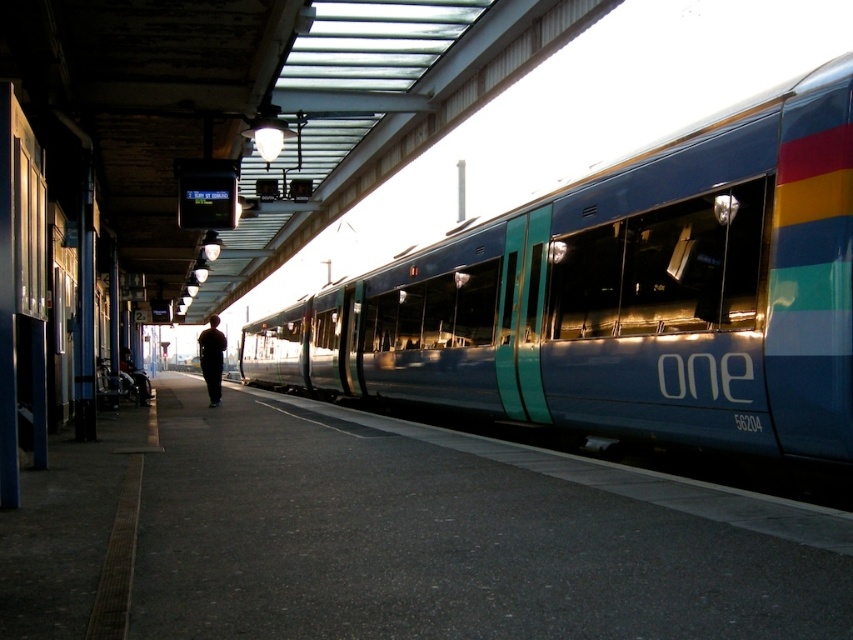
You are standing at the entrance of the train station platform. You want to board the metallic blue train at center. Based on the coordinates provided, can you determine if you are currently facing the correct direction to reach it?

The metallic blue train at center is located at coordinates point (624,296). Since you are at the entrance, you should be facing towards the center of the platform where the train is positioned to reach it.

You are standing on the train station platform and want to locate two specific points marked in the image. The first point is at coordinates point (213, 321) and the second is at point (122, 371). Which of these points is nearer to you?

Point (213, 321) is closer to the viewer than point (122, 371).

You are a passenger on the train platform and want to board the train. You see a dark fabric shirt at center and a dark blue wheelchair at lower left. Which object is closer to the train?

The dark fabric shirt at center is closer to the train because it is positioned to the left of the dark blue wheelchair at lower left, which is further away from the train.